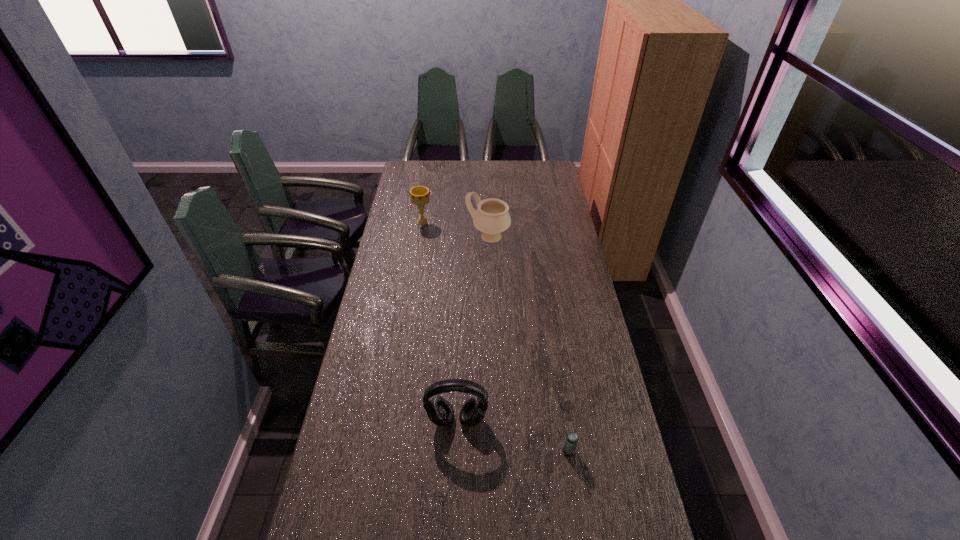
Find the location of a particular element. pottery is located at coordinates (492, 217).

Where is `the second nearest object`? The image size is (960, 540). the second nearest object is located at coordinates (439, 411).

You are a GUI agent. You are given a task and a screenshot of the screen. Output one action in this format:
    pyautogui.click(x=<x>, y=<y>)
    Task: Click on the chalice
    The image size is (960, 540).
    Given the screenshot: What is the action you would take?
    pyautogui.click(x=419, y=195)

This screenshot has width=960, height=540. What are the coordinates of `beer can` in the screenshot? It's located at (571, 440).

Identify the location of the shortest object. (571, 440).

You are a GUI agent. You are given a task and a screenshot of the screen. Output one action in this format:
    pyautogui.click(x=<x>, y=<y>)
    Task: Click on the free space located on the back of the pottery
    
    Given the screenshot: What is the action you would take?
    pyautogui.click(x=488, y=207)

Where is `vacant space situated 0.070m on the earcups of the headset`? vacant space situated 0.070m on the earcups of the headset is located at coordinates (456, 454).

You are a GUI agent. You are given a task and a screenshot of the screen. Output one action in this format:
    pyautogui.click(x=<x>, y=<y>)
    Task: Click on the vacant position located on the back of the leftmost object
    
    Given the screenshot: What is the action you would take?
    pyautogui.click(x=428, y=186)

Find the location of a particular element. The image size is (960, 540). vacant space located on the right of the beer can is located at coordinates (612, 451).

Locate an element on the screen. The image size is (960, 540). object that is at the left edge is located at coordinates (419, 195).